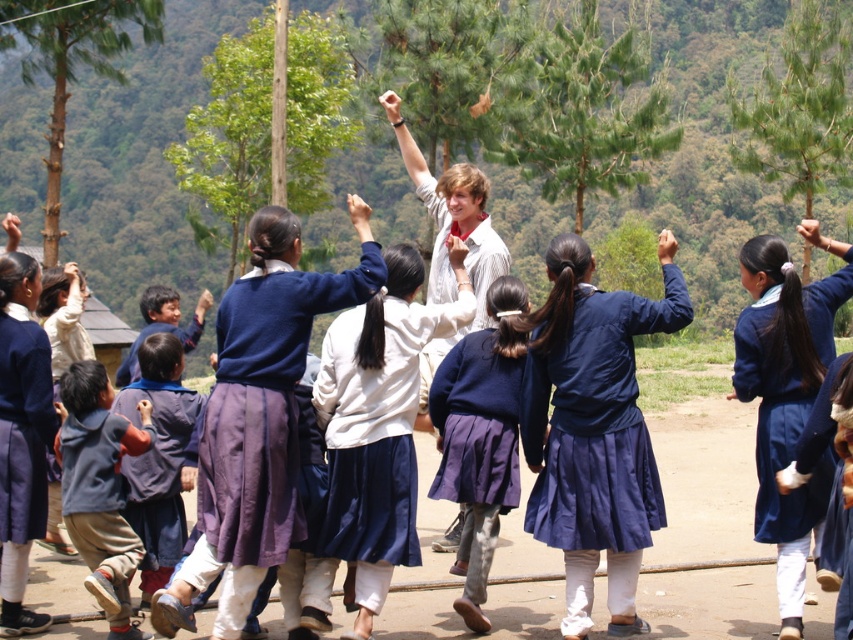
You are a photographer standing in front of the group of children and the adult. You want to take a photo that includes both the matte blue sweater at center and the matte blue sweater at upper center. Which sweater is positioned lower in the image?

The matte blue sweater at center is located below the matte blue sweater at upper center, so it is positioned lower in the image.

You are a photographer trying to capture a closeup of the smooth skin hand at center. Given that your camera can focus on objects within 5 meters, will you be able to take a clear photo of it?

The smooth skin hand at center is 10.28 meters from the camera, which is beyond the 5 meter focus range. Therefore, the camera cannot focus and capture a clear closeup of the smooth skin hand at center.